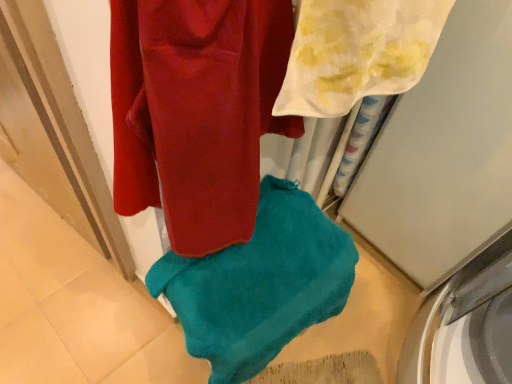
Question: Is teal soft towel at center, which appears as the second towel when viewed from the front, inside or outside of white glossy washing machine at lower right?

Choices:
 (A) outside
 (B) inside

Answer: (A)

Question: Does point click(197, 327) appear closer or farther from the camera than point click(477, 256)?

Choices:
 (A) farther
 (B) closer

Answer: (B)

Question: Which is farther from the white sheer towel at upper right, positioned as the 1th towel in top-to-bottom order?

Choices:
 (A) white glossy washing machine at lower right
 (B) teal soft towel at center, which appears as the second towel when viewed from the front

Answer: (A)

Question: Estimate the real-world distances between objects in this image. Which object is closer to the white glossy washing machine at lower right?

Choices:
 (A) teal soft towel at center, which ranks as the 1th towel in bottom-to-top order
 (B) white sheer towel at upper right, placed as the first towel when sorted from front to back

Answer: (A)